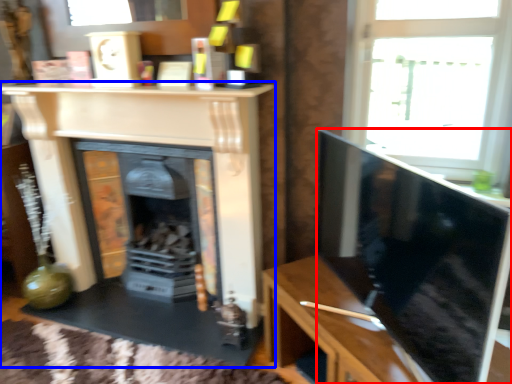
Question: Which object is closer to the camera taking this photo, screen (highlighted by a red box) or fireplace (highlighted by a blue box)?

Choices:
 (A) screen
 (B) fireplace

Answer: (A)